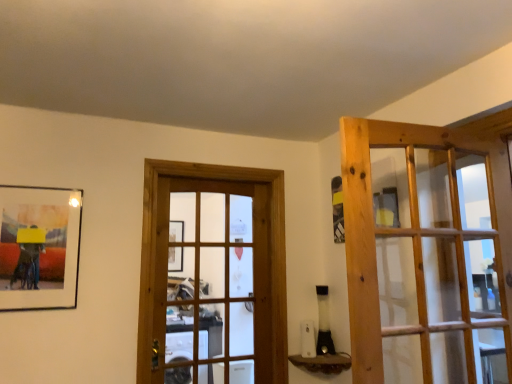
Question: Is wooden door at center, which is counted as the 2th door, starting from the right, thinner than natural wood door at right, the 1th door in the right-to-left sequence?

Choices:
 (A) no
 (B) yes

Answer: (A)

Question: Is wooden door at center, which is counted as the 2th door, starting from the right, looking in the opposite direction of natural wood door at right, acting as the second door starting from the left?

Choices:
 (A) no
 (B) yes

Answer: (A)

Question: Is natural wood door at right, acting as the second door starting from the left, surrounded by wooden door at center, which is the 1th door in left-to-right order?

Choices:
 (A) no
 (B) yes

Answer: (A)

Question: From the image's perspective, is wooden door at center, which is the 2th door in front-to-back order, located above natural wood door at right, acting as the second door starting from the left?

Choices:
 (A) yes
 (B) no

Answer: (B)

Question: Does wooden door at center, which is counted as the 2th door, starting from the right, have a lesser height compared to natural wood door at right, positioned as the first door in front-to-back order?

Choices:
 (A) yes
 (B) no

Answer: (B)

Question: Is matte black picture frame at left spatially inside natural wood door at right, acting as the 2th door starting from the back, or outside of it?

Choices:
 (A) outside
 (B) inside

Answer: (A)

Question: Based on their sizes in the image, would you say matte black picture frame at left is bigger or smaller than natural wood door at right, the 1th door in the right-to-left sequence?

Choices:
 (A) small
 (B) big

Answer: (A)

Question: From the image's perspective, is matte black picture frame at left positioned above or below natural wood door at right, acting as the second door starting from the left?

Choices:
 (A) above
 (B) below

Answer: (B)

Question: Is matte black picture frame at left in front of or behind natural wood door at right, positioned as the first door in front-to-back order, in the image?

Choices:
 (A) behind
 (B) front

Answer: (A)

Question: From a real-world perspective, is matte black picture frame at left positioned above or below wooden door at center, which is the 2th door in front-to-back order?

Choices:
 (A) above
 (B) below

Answer: (A)

Question: Is matte black picture frame at left situated inside wooden door at center, which is counted as the 2th door, starting from the right, or outside?

Choices:
 (A) inside
 (B) outside

Answer: (B)

Question: Is point (41, 223) positioned closer to the camera than point (245, 178)?

Choices:
 (A) closer
 (B) farther

Answer: (A)

Question: Looking at the image, does matte black picture frame at left seem bigger or smaller compared to wooden door at center, acting as the first door starting from the back?

Choices:
 (A) small
 (B) big

Answer: (A)

Question: Choose the correct answer: Is wooden door at center, acting as the first door starting from the back, inside brown textured wood at lower center or outside it?

Choices:
 (A) outside
 (B) inside

Answer: (A)

Question: From the image's perspective, is wooden door at center, which is the 1th door in left-to-right order, above or below brown textured wood at lower center?

Choices:
 (A) above
 (B) below

Answer: (A)